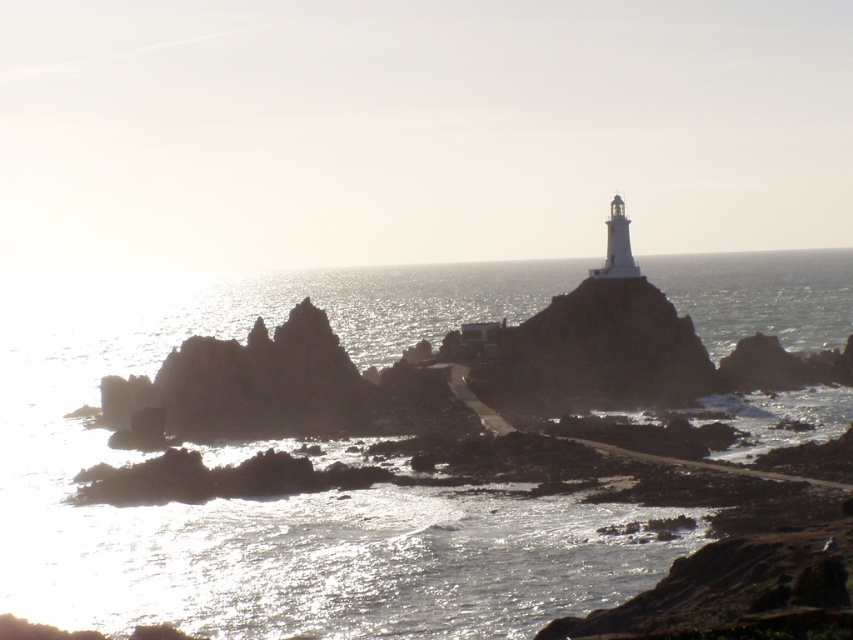
Question: Does glistening silver water at center come in front of dark gray rocky outcrop at center?

Choices:
 (A) no
 (B) yes

Answer: (B)

Question: Considering the relative positions of glistening silver water at center and dark gray rocky outcrop at center in the image provided, where is glistening silver water at center located with respect to dark gray rocky outcrop at center?

Choices:
 (A) below
 (B) above

Answer: (B)

Question: Which point is closer to the camera?

Choices:
 (A) dark gray rocky outcrop at center
 (B) glistening silver water at center

Answer: (B)

Question: Does glistening silver water at center have a smaller size compared to dark gray rocky outcrop at center?

Choices:
 (A) yes
 (B) no

Answer: (B)